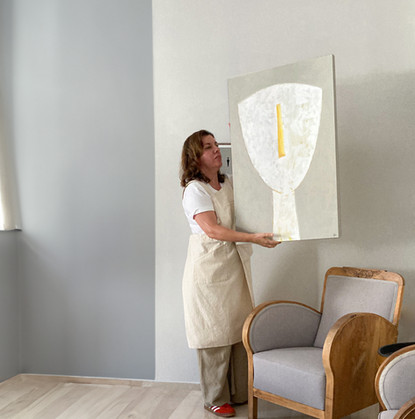
Find the location of `back of chair`. back of chair is located at coordinates (358, 299).